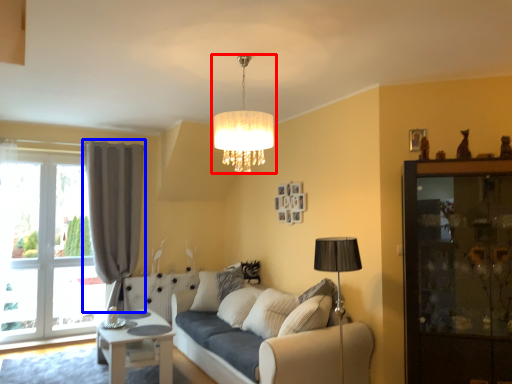
Question: Which point is further to the camera, lamp (highlighted by a red box) or curtain (highlighted by a blue box)?

Choices:
 (A) lamp
 (B) curtain

Answer: (B)